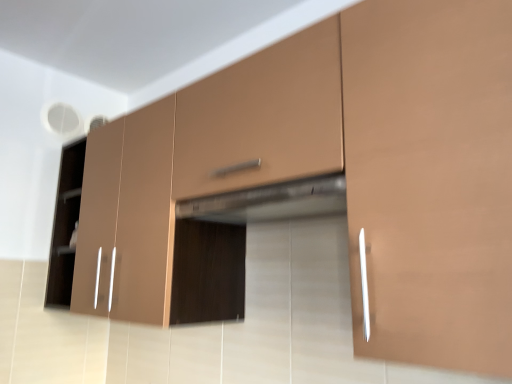
Where is `satin metallic exhaust hood at center`? satin metallic exhaust hood at center is located at coordinates (270, 202).

The image size is (512, 384). Find the location of `matte brown drawer at center`. matte brown drawer at center is located at coordinates (262, 118).

What do you see at coordinates (431, 179) in the screenshot? I see `matte brown cabinet at right, the first cabinetry in the front-to-back sequence` at bounding box center [431, 179].

Where is `satin metallic exhaust hood at center`? satin metallic exhaust hood at center is located at coordinates (270, 202).

From the image's perspective, which is below, matte brown drawer at center or matte brown cabinet at right, the 2th cabinetry positioned from the left?

matte brown cabinet at right, the 2th cabinetry positioned from the left, is shown below in the image.

The width and height of the screenshot is (512, 384). Find the location of `drawer above the matte brown cabinet at right, which ranks as the first cabinetry in right-to-left order (from the image's perspective)`. drawer above the matte brown cabinet at right, which ranks as the first cabinetry in right-to-left order (from the image's perspective) is located at coordinates (262, 118).

Would you say matte brown drawer at center is inside or outside matte brown cabinet at right, the second cabinetry viewed from the back?

The correct answer is: outside.

Which of these two, matte brown drawer at center or matte brown cabinet at right, the 2th cabinetry positioned from the left, is smaller?

matte brown drawer at center is smaller.

From the picture: How many degrees apart are the facing directions of satin metallic exhaust hood at center and matte brown cabinet at center, arranged as the first cabinetry when viewed from the left?

The facing directions of satin metallic exhaust hood at center and matte brown cabinet at center, arranged as the first cabinetry when viewed from the left, are 6.22e-05 degrees apart.

Between point (290, 202) and point (83, 261), which one is positioned in front?

Point (290, 202)

Who is bigger, satin metallic exhaust hood at center or matte brown cabinet at center, the second cabinetry when ordered from front to back?

matte brown cabinet at center, the second cabinetry when ordered from front to back, is bigger.

Considering the sizes of objects satin metallic exhaust hood at center and matte brown cabinet at center, which is the 1th cabinetry from back to front, in the image provided, who is wider, satin metallic exhaust hood at center or matte brown cabinet at center, which is the 1th cabinetry from back to front,?

matte brown cabinet at center, which is the 1th cabinetry from back to front, is wider.

Does satin metallic exhaust hood at center have a larger size compared to matte brown cabinet at right, the first cabinetry in the front-to-back sequence?

Incorrect, satin metallic exhaust hood at center is not larger than matte brown cabinet at right, the first cabinetry in the front-to-back sequence.

Could you measure the distance between satin metallic exhaust hood at center and matte brown cabinet at right, which ranks as the first cabinetry in right-to-left order?

The distance of satin metallic exhaust hood at center from matte brown cabinet at right, which ranks as the first cabinetry in right-to-left order, is 10.54 inches.

Between satin metallic exhaust hood at center and matte brown cabinet at right, the first cabinetry in the front-to-back sequence, which one appears on the left side from the viewer's perspective?

From the viewer's perspective, satin metallic exhaust hood at center appears more on the left side.

Is matte brown cabinet at right, the first cabinetry in the front-to-back sequence, smaller than matte brown cabinet at center, the second cabinetry when ordered from front to back?

Indeed, matte brown cabinet at right, the first cabinetry in the front-to-back sequence, has a smaller size compared to matte brown cabinet at center, the second cabinetry when ordered from front to back.

Can you tell me how much matte brown cabinet at right, the second cabinetry viewed from the back, and matte brown cabinet at center, which is the 1th cabinetry from back to front, differ in facing direction?

There is a 3.19e-05-degree angle between the facing directions of matte brown cabinet at right, the second cabinetry viewed from the back, and matte brown cabinet at center, which is the 1th cabinetry from back to front.

Would you consider matte brown cabinet at right, the 2th cabinetry positioned from the left, to be distant from matte brown cabinet at center, the second cabinetry when ordered from front to back?

That's not correct — matte brown cabinet at right, the 2th cabinetry positioned from the left, is a little close to matte brown cabinet at center, the second cabinetry when ordered from front to back.

Between matte brown cabinet at right, the first cabinetry in the front-to-back sequence, and matte brown cabinet at center, the 2th cabinetry from the right, which one is positioned in front?

matte brown cabinet at right, the first cabinetry in the front-to-back sequence.

Is matte brown cabinet at center, arranged as the first cabinetry when viewed from the left, far from matte brown cabinet at right, which ranks as the first cabinetry in right-to-left order?

No, matte brown cabinet at center, arranged as the first cabinetry when viewed from the left, is not far from matte brown cabinet at right, which ranks as the first cabinetry in right-to-left order.

Is matte brown cabinet at center, the 2th cabinetry from the right, to the right of matte brown cabinet at right, the 2th cabinetry positioned from the left, from the viewer's perspective?

In fact, matte brown cabinet at center, the 2th cabinetry from the right, is to the left of matte brown cabinet at right, the 2th cabinetry positioned from the left.

Can you confirm if matte brown drawer at center is thinner than satin metallic exhaust hood at center?

No.

Consider the image. Is matte brown drawer at center situated inside satin metallic exhaust hood at center or outside?

matte brown drawer at center is spatially situated outside satin metallic exhaust hood at center.

Is matte brown drawer at center oriented away from satin metallic exhaust hood at center?

No.

Is matte brown drawer at center further to camera compared to satin metallic exhaust hood at center?

No, matte brown drawer at center is in front of satin metallic exhaust hood at center.

Is satin metallic exhaust hood at center oriented away from matte brown drawer at center?

That's not correct — satin metallic exhaust hood at center is not looking away from matte brown drawer at center.

Is satin metallic exhaust hood at center far away from matte brown drawer at center?

They are positioned close to each other.

At what (x,y) coordinates should I click in order to perform the action: click on exhaust hood that is under the matte brown drawer at center (from a real-world perspective). Please return your answer as a coordinate pair (x, y). Looking at the image, I should click on (270, 202).

You are a GUI agent. You are given a task and a screenshot of the screen. Output one action in this format:
    pyautogui.click(x=<x>, y=<y>)
    Task: Click on the drawer above the matte brown cabinet at right, the first cabinetry in the front-to-back sequence (from the image's perspective)
    
    Given the screenshot: What is the action you would take?
    pyautogui.click(x=262, y=118)

The width and height of the screenshot is (512, 384). In order to click on exhaust hood that is in front of the matte brown cabinet at center, the second cabinetry when ordered from front to back in this screenshot , I will do `click(270, 202)`.

Based on their spatial positions, is satin metallic exhaust hood at center or matte brown cabinet at right, which ranks as the first cabinetry in right-to-left order, closer to matte brown cabinet at center, which is the 1th cabinetry from back to front?

The object closer to matte brown cabinet at center, which is the 1th cabinetry from back to front, is satin metallic exhaust hood at center.

Looking at the image, which one is located further to matte brown drawer at center, matte brown cabinet at center, arranged as the first cabinetry when viewed from the left, or matte brown cabinet at right, the second cabinetry viewed from the back?

Among the two, matte brown cabinet at center, arranged as the first cabinetry when viewed from the left, is located further to matte brown drawer at center.

From the image, which object appears to be nearer to matte brown cabinet at right, the second cabinetry viewed from the back, satin metallic exhaust hood at center or matte brown drawer at center?

Among the two, matte brown drawer at center is located nearer to matte brown cabinet at right, the second cabinetry viewed from the back.

Considering their positions, is matte brown cabinet at right, the first cabinetry in the front-to-back sequence, positioned further to satin metallic exhaust hood at center than matte brown drawer at center?

matte brown cabinet at right, the first cabinetry in the front-to-back sequence.

Which object lies nearer to the anchor point matte brown cabinet at right, the second cabinetry viewed from the back, satin metallic exhaust hood at center or matte brown cabinet at center, arranged as the first cabinetry when viewed from the left?

Among the two, satin metallic exhaust hood at center is located nearer to matte brown cabinet at right, the second cabinetry viewed from the back.

Which object lies further to the anchor point matte brown cabinet at center, the 2th cabinetry from the right, satin metallic exhaust hood at center or matte brown drawer at center?

Among the two, matte brown drawer at center is located further to matte brown cabinet at center, the 2th cabinetry from the right.

Considering their positions, is matte brown drawer at center positioned closer to matte brown cabinet at center, arranged as the first cabinetry when viewed from the left, than satin metallic exhaust hood at center?

satin metallic exhaust hood at center is positioned closer to the anchor matte brown cabinet at center, arranged as the first cabinetry when viewed from the left.

Which object lies further to the anchor point matte brown cabinet at right, the 2th cabinetry positioned from the left, matte brown drawer at center or satin metallic exhaust hood at center?

satin metallic exhaust hood at center.

Find the location of a particular element. drawer located between matte brown cabinet at center, which is the 1th cabinetry from back to front, and matte brown cabinet at right, the first cabinetry in the front-to-back sequence, in the left-right direction is located at coordinates (262, 118).

The height and width of the screenshot is (384, 512). What are the coordinates of `exhaust hood situated between matte brown cabinet at center, the second cabinetry when ordered from front to back, and matte brown cabinet at right, the first cabinetry in the front-to-back sequence, from left to right` in the screenshot? It's located at (270, 202).

Image resolution: width=512 pixels, height=384 pixels. In order to click on exhaust hood situated between matte brown drawer at center and matte brown cabinet at right, the first cabinetry in the front-to-back sequence, from left to right in this screenshot , I will do `click(270, 202)`.

At what (x,y) coordinates should I click in order to perform the action: click on drawer between matte brown cabinet at center, the 2th cabinetry from the right, and satin metallic exhaust hood at center. Please return your answer as a coordinate pair (x, y). Looking at the image, I should click on (262, 118).